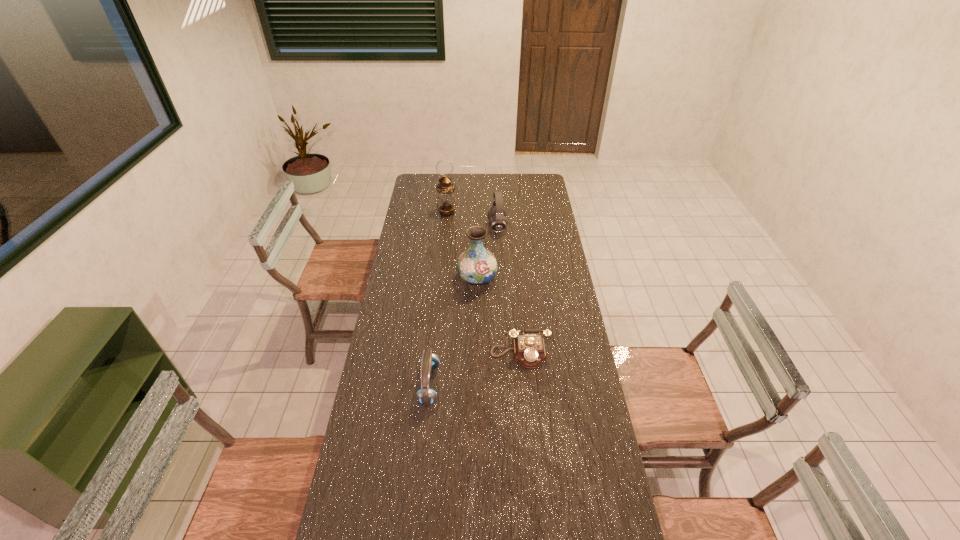
Locate an element on the screen. vacant space located 0.140m on the left of the second tallest object is located at coordinates (425, 278).

The height and width of the screenshot is (540, 960). I want to click on free space located 0.190m on the ear cups of the fourth nearest object, so click(450, 227).

I want to click on blank space located on the ear cups of the fourth nearest object, so [x=411, y=227].

Locate an element on the screen. The width and height of the screenshot is (960, 540). vacant space situated on the ear cups of the fourth nearest object is located at coordinates (478, 227).

Find the location of `vacant space located on the ear cups of the shorter headset`. vacant space located on the ear cups of the shorter headset is located at coordinates (541, 384).

At what (x,y) coordinates should I click in order to perform the action: click on free space located 0.260m on the dial of the telephone. Please return your answer as a coordinate pair (x, y). This screenshot has width=960, height=540. Looking at the image, I should click on (527, 436).

Locate an element on the screen. The width and height of the screenshot is (960, 540). object that is at the left edge is located at coordinates (446, 203).

The width and height of the screenshot is (960, 540). In order to click on object at the right edge in this screenshot , I will do `click(529, 350)`.

Find the location of a particular element. vacant space at the left edge of the desktop is located at coordinates (379, 484).

In the image, there is a desktop. Where is `vacant region at the right edge`? vacant region at the right edge is located at coordinates (546, 231).